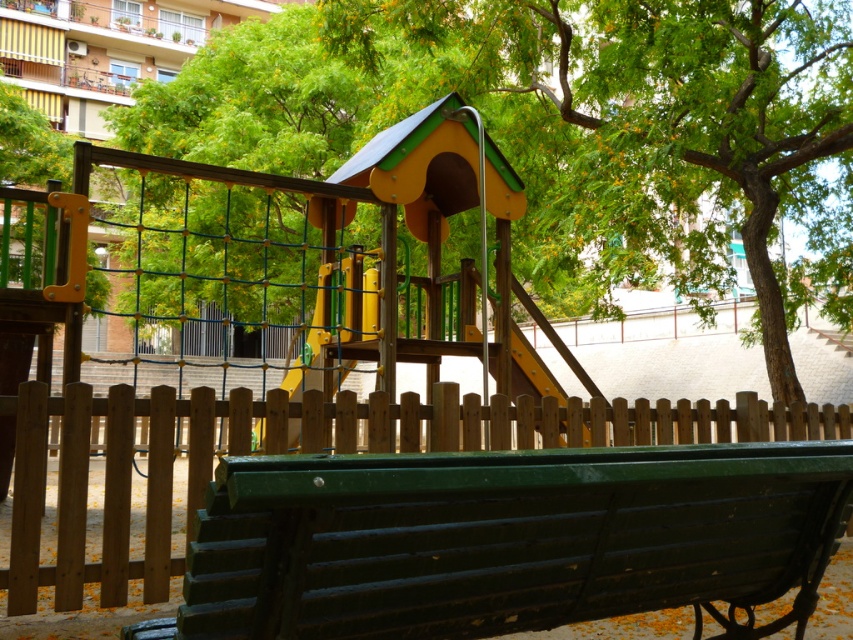
Does green painted wood bench at lower center have a lesser width compared to green leafy tree at center?

Correct, green painted wood bench at lower center's width is less than green leafy tree at center's.

Does green painted wood bench at lower center appear on the left side of green leafy tree at center?

Correct, you'll find green painted wood bench at lower center to the left of green leafy tree at center.

This screenshot has width=853, height=640. Find the location of `green painted wood bench at lower center`. green painted wood bench at lower center is located at coordinates (508, 540).